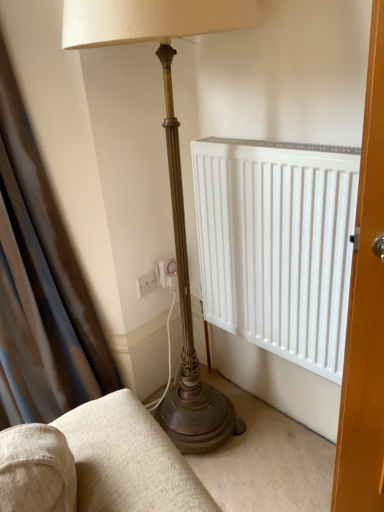
Question: Considering the positions of white plastic electric outlet at lower center and satin dark brown curtain at left in the image, is white plastic electric outlet at lower center bigger or smaller than satin dark brown curtain at left?

Choices:
 (A) small
 (B) big

Answer: (A)

Question: Considering the positions of point (147, 275) and point (56, 403), is point (147, 275) closer or farther from the camera than point (56, 403)?

Choices:
 (A) farther
 (B) closer

Answer: (A)

Question: Would you say white plastic electric outlet at lower center is to the left or to the right of satin dark brown curtain at left in the picture?

Choices:
 (A) left
 (B) right

Answer: (B)

Question: Considering the positions of point (57, 372) and point (150, 282), is point (57, 372) closer or farther from the camera than point (150, 282)?

Choices:
 (A) closer
 (B) farther

Answer: (A)

Question: In the image, is satin dark brown curtain at left positioned in front of or behind white plastic electric outlet at lower center?

Choices:
 (A) behind
 (B) front

Answer: (B)

Question: Based on their sizes in the image, would you say satin dark brown curtain at left is bigger or smaller than white plastic electric outlet at lower center?

Choices:
 (A) big
 (B) small

Answer: (A)

Question: From a real-world perspective, is satin dark brown curtain at left above or below white plastic electric outlet at lower center?

Choices:
 (A) below
 (B) above

Answer: (B)